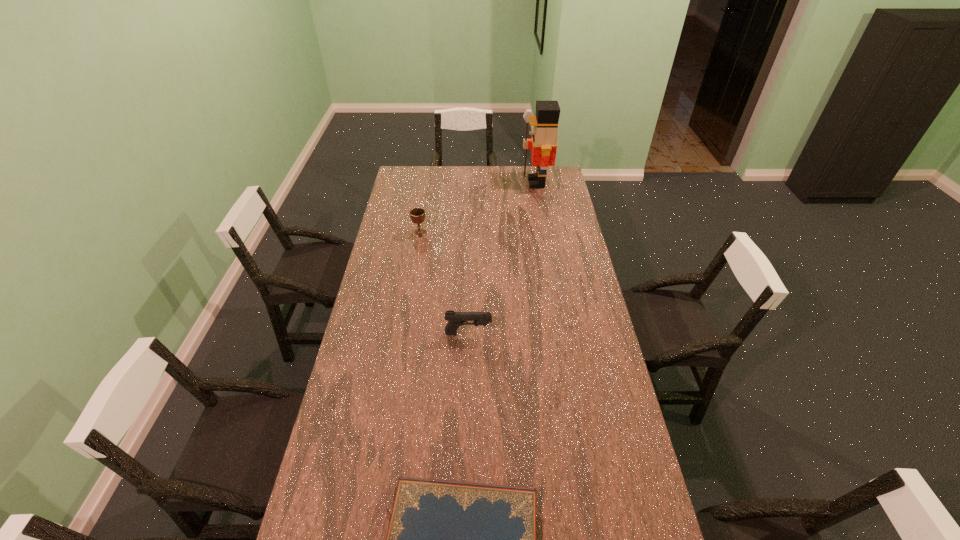
Where is `the rightmost object`? the rightmost object is located at coordinates (543, 143).

Identify the location of the farthest object. The width and height of the screenshot is (960, 540). (543, 143).

Find the location of a particular element. Image resolution: width=960 pixels, height=540 pixels. chalice is located at coordinates (417, 215).

The width and height of the screenshot is (960, 540). In order to click on the leftmost object in this screenshot , I will do 417,215.

Find the location of `pistol`. pistol is located at coordinates (455, 319).

Locate an element on the screen. This screenshot has width=960, height=540. free space located 0.210m in front of the tallest object holding the staff is located at coordinates (482, 183).

The height and width of the screenshot is (540, 960). What are the coordinates of `free space located in front of the tallest object holding the staff` in the screenshot? It's located at (459, 183).

Where is `vacant area situated in front of the tallest object holding the staff`? The image size is (960, 540). vacant area situated in front of the tallest object holding the staff is located at coordinates (508, 183).

Where is `blank space located 0.290m on the right of the third nearest object`? This screenshot has width=960, height=540. blank space located 0.290m on the right of the third nearest object is located at coordinates (489, 233).

Identify the location of free region located at the barrel of the second nearest object. The width and height of the screenshot is (960, 540). (529, 334).